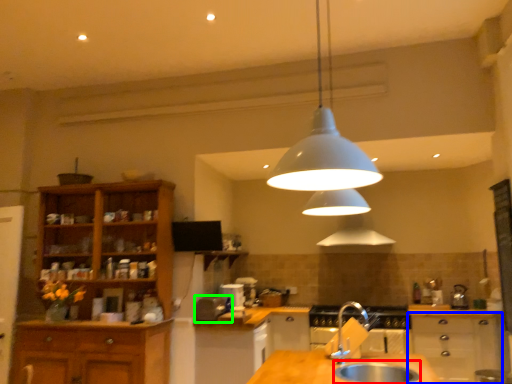
Question: Which object is the closest to the sink (highlighted by a red box)? Choose among these: cabinetry (highlighted by a blue box) or appliance (highlighted by a green box).

Choices:
 (A) cabinetry
 (B) appliance

Answer: (B)